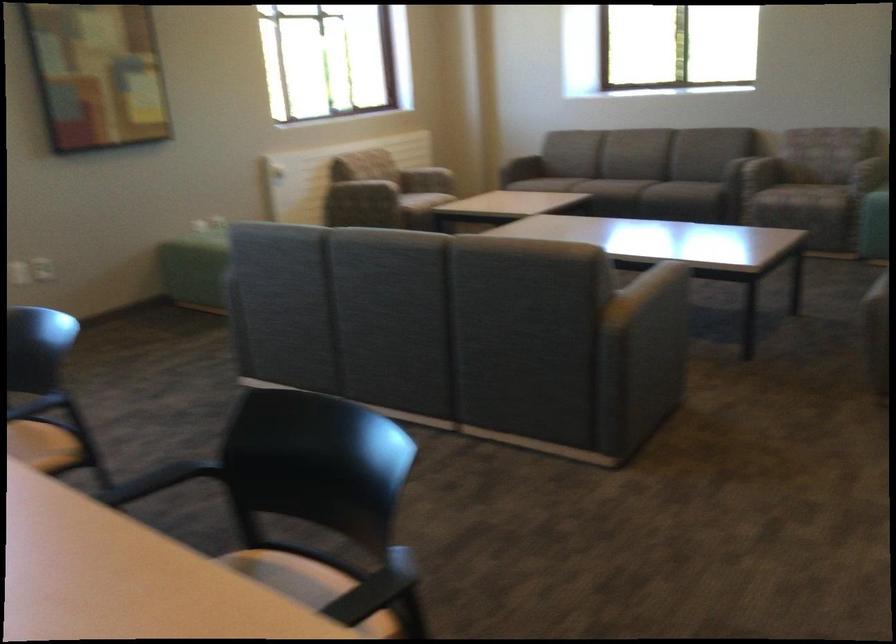
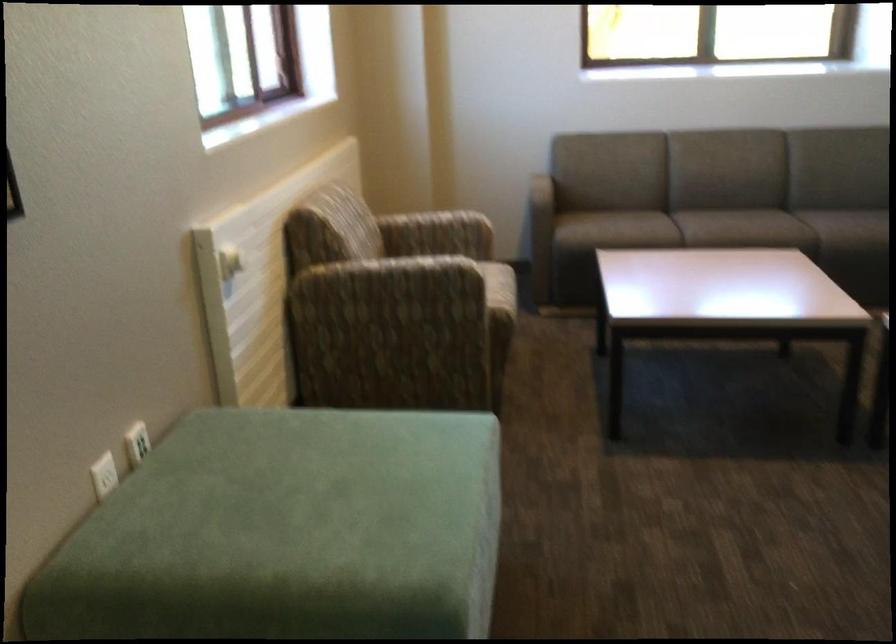
Locate, in the second image, the point that corresponds to pixel 192 220 in the first image.

(104, 475)